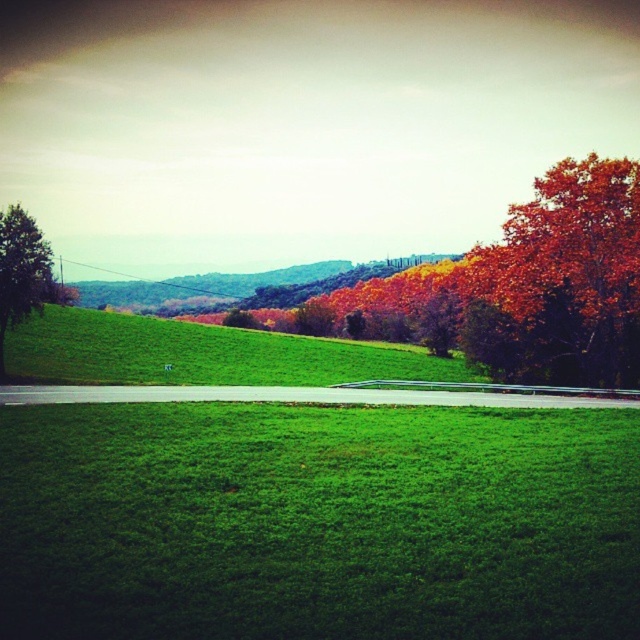
Is green grassy field at lower center thinner than shiny red leaves at right?

Incorrect, green grassy field at lower center's width is not less than shiny red leaves at right's.

Is green grassy field at lower center taller than shiny red leaves at right?

No.

Which is in front, point (429, 637) or point (621, 228)?

Point (429, 637)

You are a GUI agent. You are given a task and a screenshot of the screen. Output one action in this format:
    pyautogui.click(x=<x>, y=<y>)
    Task: Click on the green grassy field at lower center
    
    Given the screenshot: What is the action you would take?
    pyautogui.click(x=317, y=522)

Is point (616, 196) positioned after point (0, 348)?

That is True.

Is point (598, 273) positioned before point (28, 236)?

That is False.

You are a GUI agent. You are given a task and a screenshot of the screen. Output one action in this format:
    pyautogui.click(x=<x>, y=<y>)
    Task: Click on the shiny red leaves at right
    The image size is (640, 640).
    Given the screenshot: What is the action you would take?
    pyautogui.click(x=563, y=280)

How much distance is there between green grassy field at lower center and autumn foliage at upper right?

green grassy field at lower center and autumn foliage at upper right are 41.81 meters apart from each other.

Is point (368, 548) positioned before point (397, 308)?

Yes, it is.

Locate an element on the screen. The image size is (640, 640). green grassy field at lower center is located at coordinates (317, 522).